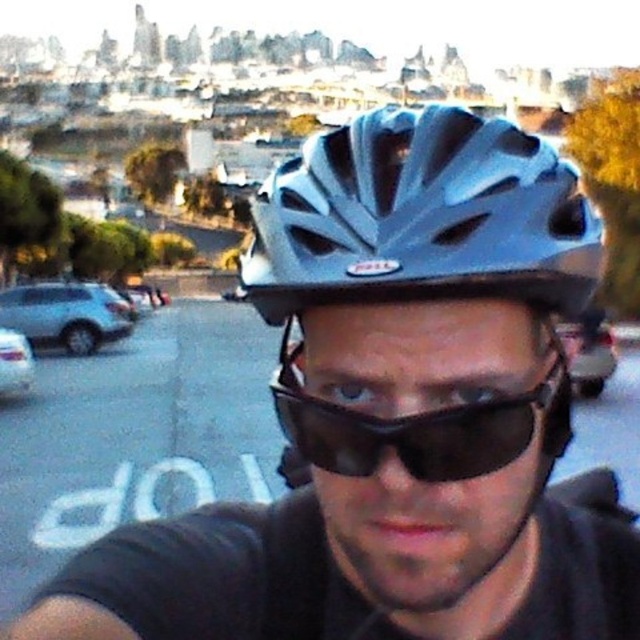
You are a cyclist who just arrived at an intersection. You see the matte gray helmet at center and the black matte sunglasses at center. Which object is closer to you?

The matte gray helmet at center is closer to you because it is in front of the black matte sunglasses at center.

You are a cyclist wearing a matte gray helmet at center and black matte sunglasses at center. You want to check if your sunglasses are positioned correctly. Are your sunglasses below your helmet?

The matte gray helmet at center is located above the black matte sunglasses at center, so yes, your sunglasses are positioned correctly below your helmet.